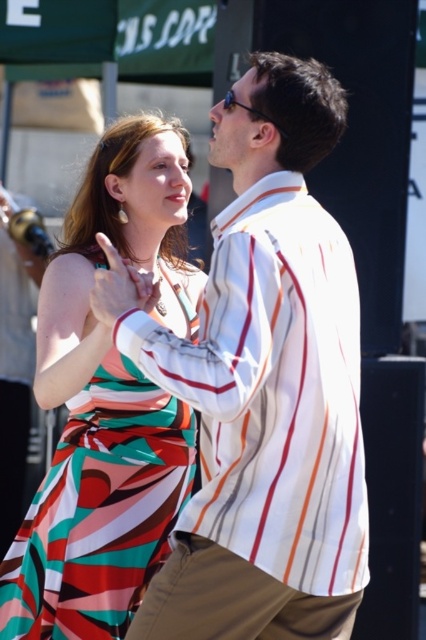
You are a photographer trying to capture a clear shot of both the multicolored striped dress at center and the khaki pants at lower center. Which one should you focus on first to ensure it appears sharp in the photo?

You should focus on the multicolored striped dress at center first because it is closer to the viewer than the khaki pants at lower center, so it requires a different focal plane.

You are a photographer trying to capture a candid shot of the two people in the image. Since you want to focus on their clothing, you need to position your camera so that the white striped shirt at center and the khaki pants at lower center are both in frame. Based on their positions, which direction should you move your camera to ensure both are visible?

The white striped shirt at center is to the left of khaki pants at lower center, so moving the camera to the right would ensure both are visible in the frame.